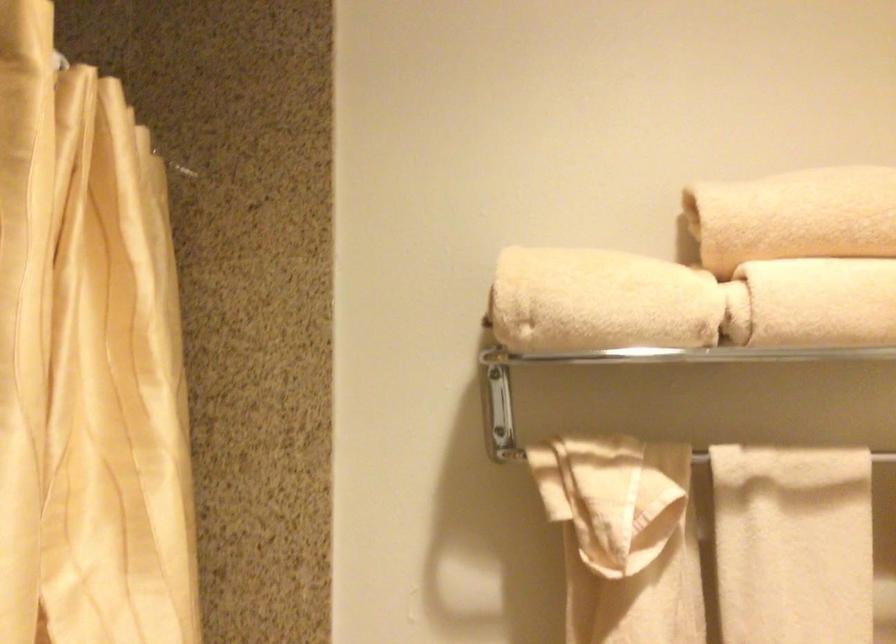
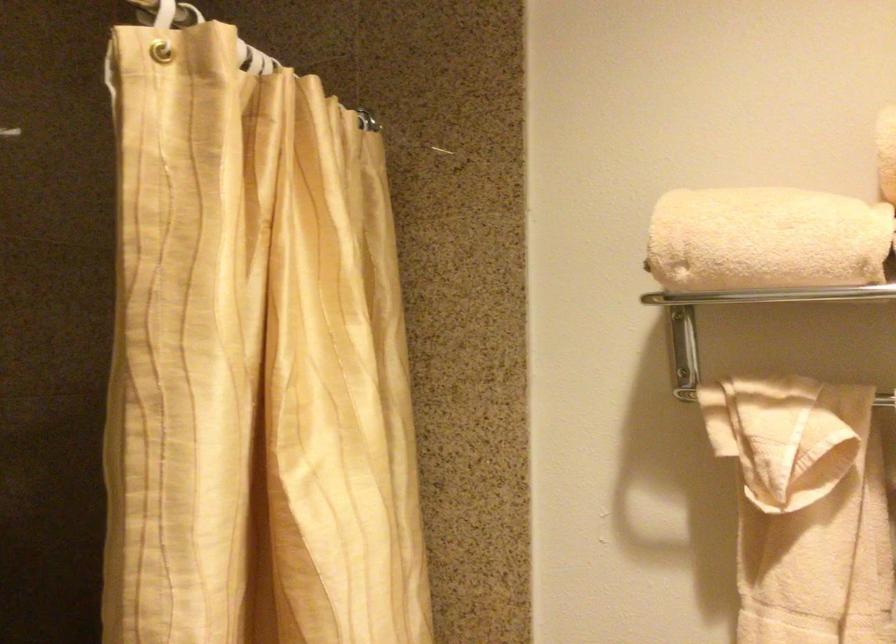
Locate, in the second image, the point that corresponds to point 612,301 in the first image.

(765, 240)